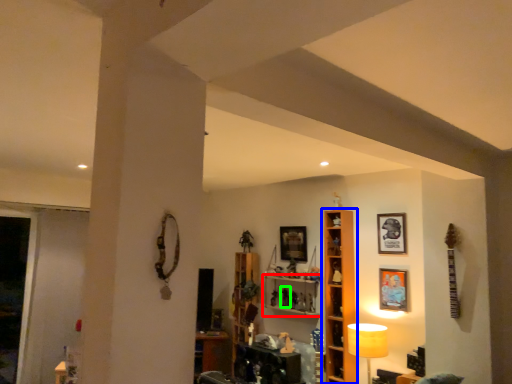
Question: Which is nearer to the shelf (highlighted by a red box)? shelf (highlighted by a blue box) or toy (highlighted by a green box).

Choices:
 (A) shelf
 (B) toy

Answer: (B)